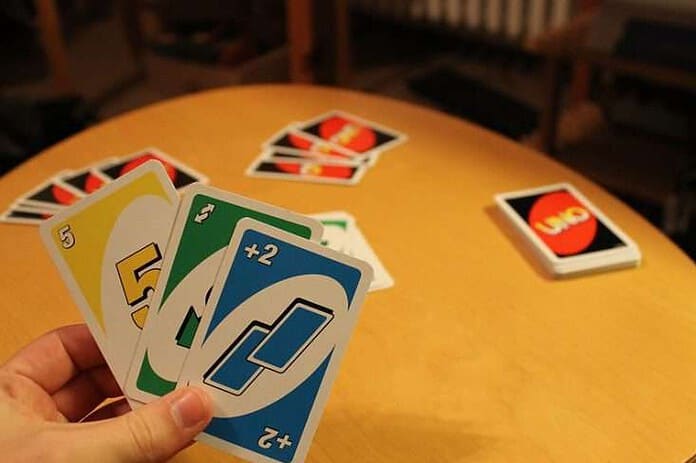
Identify the location of stack of uno cards. This screenshot has height=463, width=696. (571, 222).